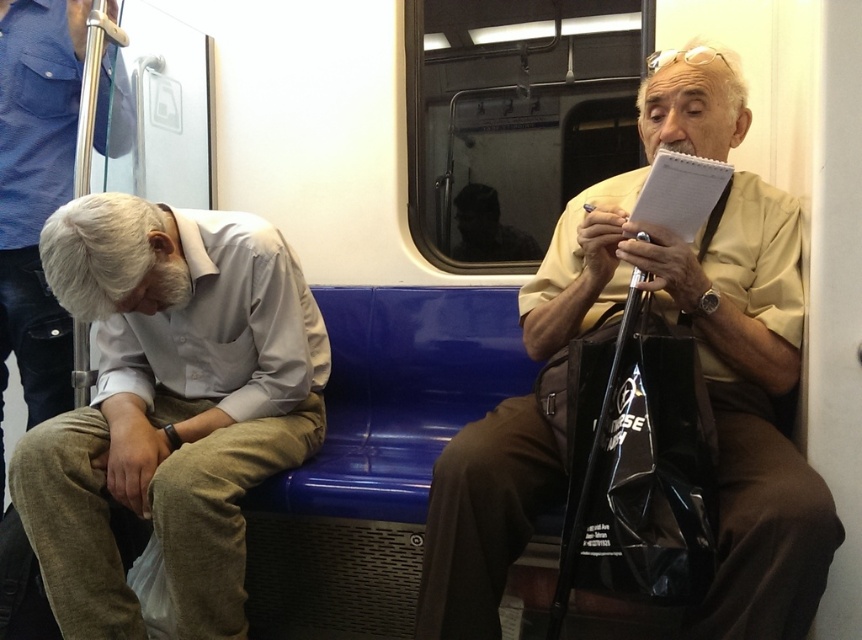
Can you confirm if light gray cotton shirt at lower left is positioned to the right of yellow matte shirt at upper right?

No, light gray cotton shirt at lower left is not to the right of yellow matte shirt at upper right.

Which is behind, point (184, 284) or point (735, 522)?

The point (184, 284) is more distant.

Find the location of a particular element. The image size is (862, 640). light gray cotton shirt at lower left is located at coordinates (167, 406).

Between light gray cotton shirt at lower left and gray cotton shirt at left, which one has less height?

With less height is light gray cotton shirt at lower left.

How much distance is there between light gray cotton shirt at lower left and gray cotton shirt at left?

light gray cotton shirt at lower left is 19.05 inches from gray cotton shirt at left.

Between point (148, 260) and point (28, 90), which one is positioned behind?

Point (28, 90)

You are a GUI agent. You are given a task and a screenshot of the screen. Output one action in this format:
    pyautogui.click(x=<x>, y=<y>)
    Task: Click on the light gray cotton shirt at lower left
    
    Given the screenshot: What is the action you would take?
    pyautogui.click(x=167, y=406)

Looking at this image, is yellow matte shirt at upper right taller than gray cotton shirt at left?

In fact, yellow matte shirt at upper right may be shorter than gray cotton shirt at left.

Does yellow matte shirt at upper right appear over gray cotton shirt at left?

Incorrect, yellow matte shirt at upper right is not positioned above gray cotton shirt at left.

Find the location of a particular element. This screenshot has height=640, width=862. yellow matte shirt at upper right is located at coordinates (714, 380).

Locate an element on the screen. yellow matte shirt at upper right is located at coordinates (714, 380).